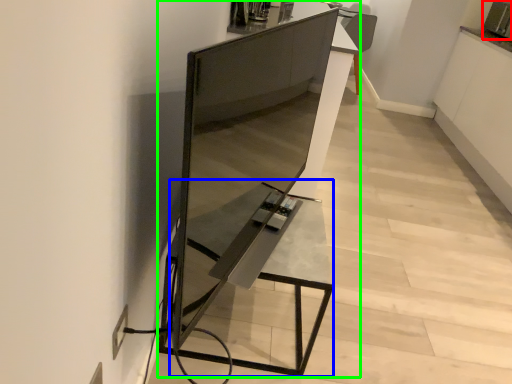
Question: Estimate the real-world distances between objects in this image. Which object is closer to appliance (highlighted by a red box), table (highlighted by a blue box) or furniture (highlighted by a green box)?

Choices:
 (A) table
 (B) furniture

Answer: (B)